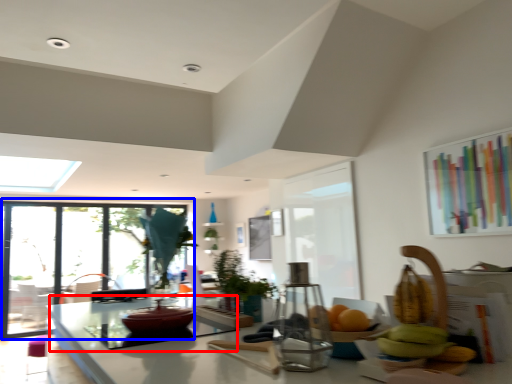
Question: Which object is closer to the camera taking this photo, glass table (highlighted by a red box) or window (highlighted by a blue box)?

Choices:
 (A) glass table
 (B) window

Answer: (A)